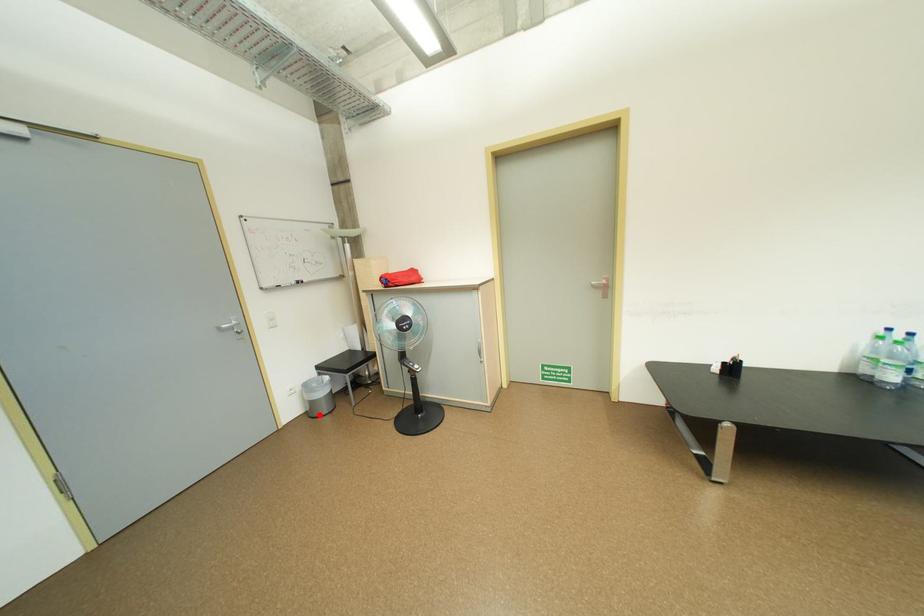
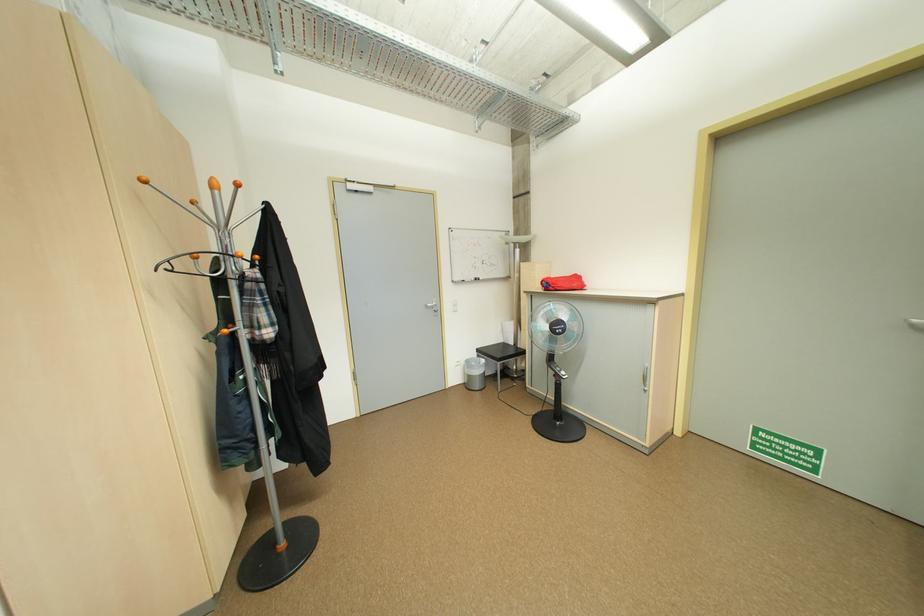
Question: A red point is marked in image1. In image2, is the corresponding 3D point closer to the camera or farther? Reply with the corresponding letter.

Choices:
 (A) The corresponding 3D point is closer.
 (B) The corresponding 3D point is farther.

Answer: (B)